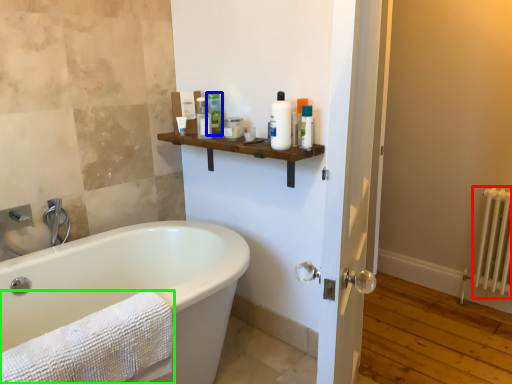
Question: Which object is positioned farthest from radiator (highlighted by a red box)? Select from toiletry (highlighted by a blue box) and towel (highlighted by a green box).

Choices:
 (A) toiletry
 (B) towel

Answer: (B)